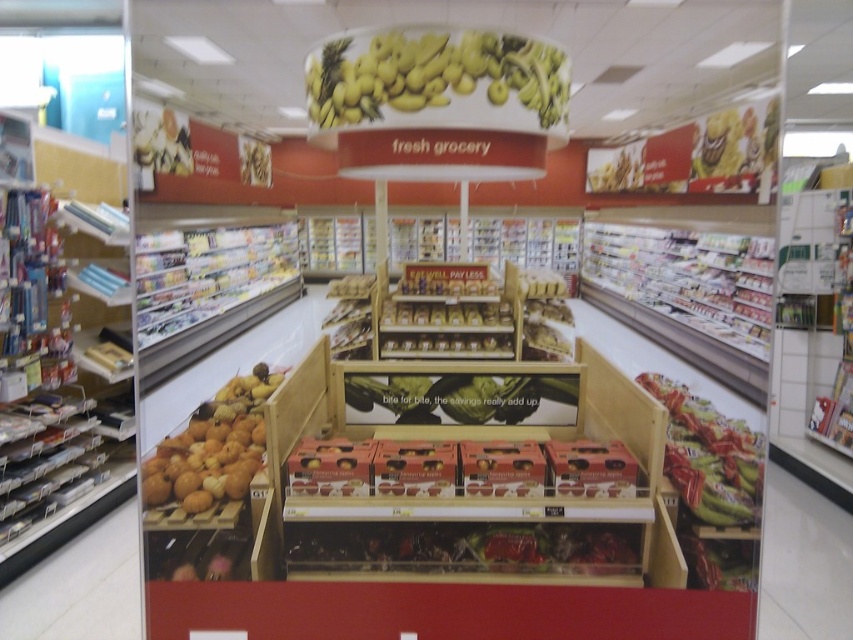
Who is positioned more to the left, yellow matte bananas at upper center or metallic silver shelves at left?

From the viewer's perspective, metallic silver shelves at left appears more on the left side.

What do you see at coordinates (433, 76) in the screenshot? I see `yellow matte bananas at upper center` at bounding box center [433, 76].

Who is more forward, (328, 116) or (250, 250)?

Positioned in front is point (328, 116).

Where is `yellow matte bananas at upper center`? Image resolution: width=853 pixels, height=640 pixels. yellow matte bananas at upper center is located at coordinates coord(433,76).

Is point (621, 536) closer to viewer compared to point (408, 390)?

Yes, point (621, 536) is closer to viewer.

Between shiny plastic berries at center and green matte leaf at center, which one appears on the right side from the viewer's perspective?

From the viewer's perspective, green matte leaf at center appears more on the right side.

You are a GUI agent. You are given a task and a screenshot of the screen. Output one action in this format:
    pyautogui.click(x=<x>, y=<y>)
    Task: Click on the shiny plastic berries at center
    This screenshot has width=853, height=640.
    Given the screenshot: What is the action you would take?
    pyautogui.click(x=462, y=547)

Is point (366, 120) less distant than point (488, 561)?

Yes, point (366, 120) is closer to viewer.

The height and width of the screenshot is (640, 853). I want to click on yellow matte bananas at upper center, so click(433, 76).

Where is `yellow matte bananas at upper center`? yellow matte bananas at upper center is located at coordinates (433, 76).